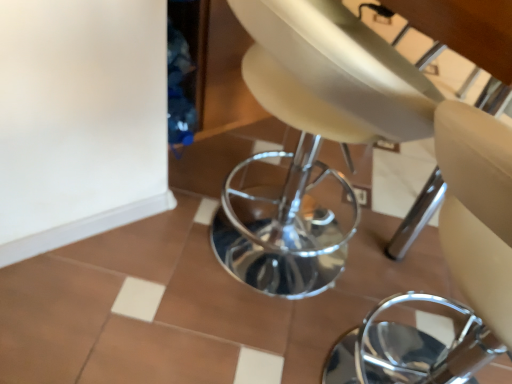
Describe the element at coordinates (312, 139) in the screenshot. I see `beige leather swivel chair at center` at that location.

Identify the location of beige leather chair at center. This screenshot has width=512, height=384. (450, 267).

What's the angular difference between white glossy tile at lower left and beige leather chair at center's facing directions?

92.5 degrees separate the facing orientations of white glossy tile at lower left and beige leather chair at center.

Is the surface of white glossy tile at lower left in direct contact with beige leather chair at center?

No, white glossy tile at lower left is not next to beige leather chair at center.

Where is `chair on the right of white glossy tile at lower left`? The image size is (512, 384). chair on the right of white glossy tile at lower left is located at coordinates (450, 267).

Is white glossy tile at lower left aimed at beige leather chair at center?

No, white glossy tile at lower left is not turned towards beige leather chair at center.

Is beige leather chair at center aimed at beige leather swivel chair at center?

No, beige leather chair at center is not aimed at beige leather swivel chair at center.

Which of these two, beige leather chair at center or beige leather swivel chair at center, is smaller?

beige leather chair at center.

In the scene shown: Is beige leather chair at center located outside beige leather swivel chair at center?

beige leather chair at center is positioned outside beige leather swivel chair at center.

Considering the points (366, 318) and (334, 174), which point is behind, point (366, 318) or point (334, 174)?

Point (334, 174)

From the image's perspective, between beige leather swivel chair at center and beige leather chair at center, which one is located above?

beige leather swivel chair at center, from the image's perspective.

Considering the positions of point (374, 42) and point (497, 150), is point (374, 42) closer or farther from the camera than point (497, 150)?

Point (374, 42).

Locate an element on the screen. The image size is (512, 384). swivel chair lying on the left of beige leather chair at center is located at coordinates (312, 139).

Is there a large distance between beige leather swivel chair at center and beige leather chair at center?

Actually, beige leather swivel chair at center and beige leather chair at center are a little close together.

Is beige leather chair at center bigger or smaller than white glossy tile at lower left?

Clearly, beige leather chair at center is larger in size than white glossy tile at lower left.

Which is nearer, (442, 112) or (155, 220)?

Positioned in front is point (442, 112).

From the image's perspective, which one is positioned lower, beige leather chair at center or white glossy tile at lower left?

beige leather chair at center.

From the picture: From a real-world perspective, is white glossy tile at lower left above or below beige leather swivel chair at center?

white glossy tile at lower left is situated lower than beige leather swivel chair at center in the real world.

This screenshot has width=512, height=384. I want to click on ceramic tile directly beneath the beige leather swivel chair at center (from a real-world perspective), so click(x=139, y=244).

Considering the sizes of white glossy tile at lower left and beige leather swivel chair at center in the image, is white glossy tile at lower left taller or shorter than beige leather swivel chair at center?

Clearly, white glossy tile at lower left is shorter compared to beige leather swivel chair at center.

Which point is more forward, (x=148, y=241) or (x=241, y=224)?

The point (x=241, y=224) is in front.

Considering the sizes of objects beige leather swivel chair at center and white glossy tile at lower left in the image provided, who is taller, beige leather swivel chair at center or white glossy tile at lower left?

beige leather swivel chair at center is taller.

In the image, is beige leather swivel chair at center on the left side or the right side of white glossy tile at lower left?

From the image, it's evident that beige leather swivel chair at center is to the right of white glossy tile at lower left.

Does beige leather swivel chair at center come in front of white glossy tile at lower left?

Yes, the depth of beige leather swivel chair at center is less than that of white glossy tile at lower left.

Identify the location of chair lying in front of the white glossy tile at lower left. This screenshot has height=384, width=512. (450, 267).

This screenshot has width=512, height=384. I want to click on swivel chair to the left of beige leather chair at center, so click(x=312, y=139).

Considering their positions, is white glossy tile at lower left positioned further to beige leather chair at center than beige leather swivel chair at center?

white glossy tile at lower left is further to beige leather chair at center.

Estimate the real-world distances between objects in this image. Which object is closer to beige leather chair at center, beige leather swivel chair at center or white glossy tile at lower left?

beige leather swivel chair at center is positioned closer to the anchor beige leather chair at center.

When comparing their distances from beige leather swivel chair at center, does white glossy tile at lower left or beige leather chair at center seem further?

Among the two, beige leather chair at center is located further to beige leather swivel chair at center.

Which object lies further to the anchor point beige leather swivel chair at center, beige leather chair at center or white glossy tile at lower left?

beige leather chair at center.

Considering their positions, is beige leather swivel chair at center positioned closer to white glossy tile at lower left than beige leather chair at center?

beige leather swivel chair at center lies closer to white glossy tile at lower left than the other object.

Considering their positions, is beige leather chair at center positioned further to white glossy tile at lower left than beige leather swivel chair at center?

Based on the image, beige leather chair at center appears to be further to white glossy tile at lower left.

Locate an element on the screen. The width and height of the screenshot is (512, 384). swivel chair located between beige leather chair at center and white glossy tile at lower left in the depth direction is located at coordinates (312, 139).